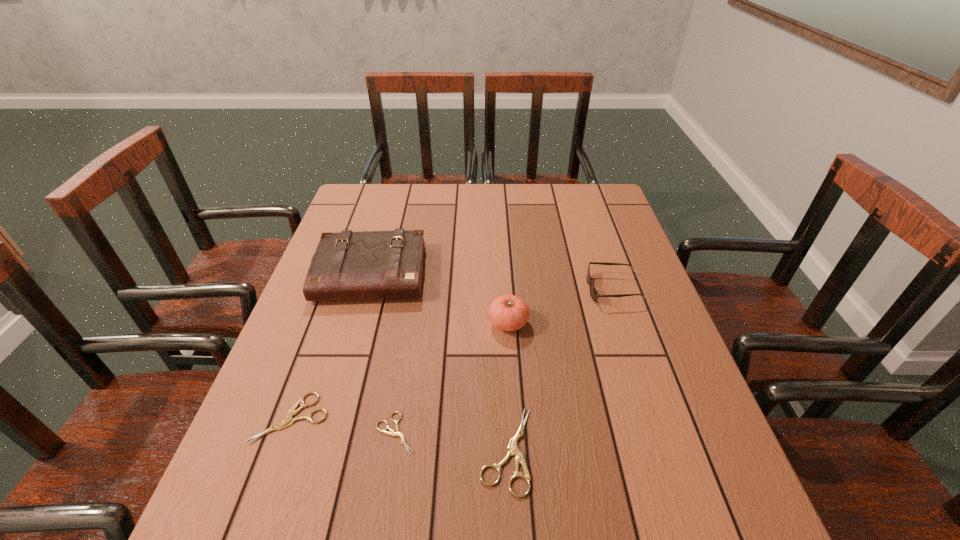
In order to click on the leftmost shears in this screenshot , I will do `click(288, 421)`.

Where is `the fifth tallest object`? The height and width of the screenshot is (540, 960). the fifth tallest object is located at coordinates (288, 421).

Where is `the shortest object`? The height and width of the screenshot is (540, 960). the shortest object is located at coordinates (398, 433).

Locate an element on the screen. the shortest shears is located at coordinates (398, 433).

Where is `the rightmost shears`? This screenshot has height=540, width=960. the rightmost shears is located at coordinates (512, 449).

The width and height of the screenshot is (960, 540). I want to click on tomato, so click(x=508, y=312).

Locate an element on the screen. hardback book is located at coordinates (347, 265).

The image size is (960, 540). In order to click on sunglasses in this screenshot , I will do pos(594,294).

Identify the location of the fourth shortest object. (594, 294).

At what (x,y) coordinates should I click in order to perform the action: click on free spot located on the back of the leftmost shears. Please return your answer as a coordinate pair (x, y). This screenshot has height=540, width=960. Looking at the image, I should click on (341, 281).